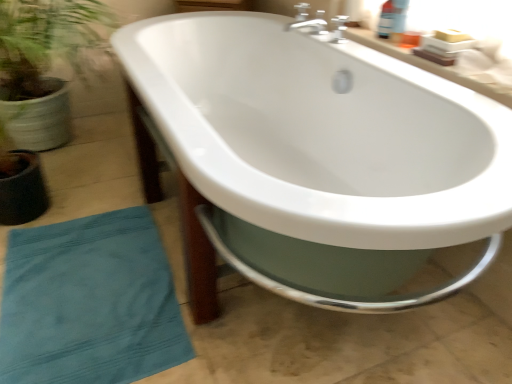
Question: Relative to teal cotton beach towel at lower left, is white glossy countertop at upper right in front or behind?

Choices:
 (A) behind
 (B) front

Answer: (A)

Question: Visually, is white glossy countertop at upper right positioned to the left or to the right of teal cotton beach towel at lower left?

Choices:
 (A) left
 (B) right

Answer: (B)

Question: Considering the real-world distances, which object is closest to the white glossy countertop at upper right?

Choices:
 (A) white glossy bathtub at center
 (B) teal cotton beach towel at lower left

Answer: (A)

Question: Which of these objects is positioned farthest from the teal cotton beach towel at lower left?

Choices:
 (A) white glossy countertop at upper right
 (B) white glossy bathtub at center

Answer: (A)